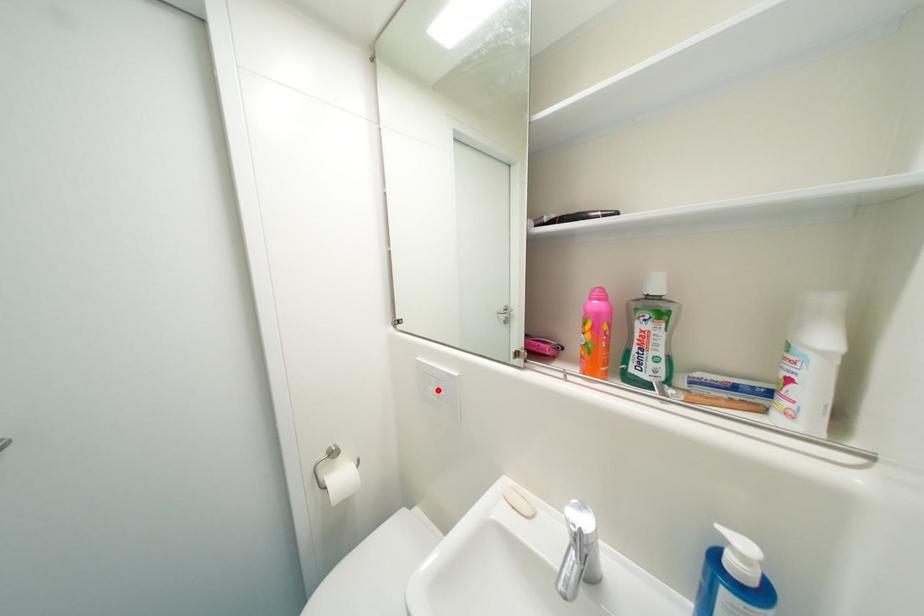
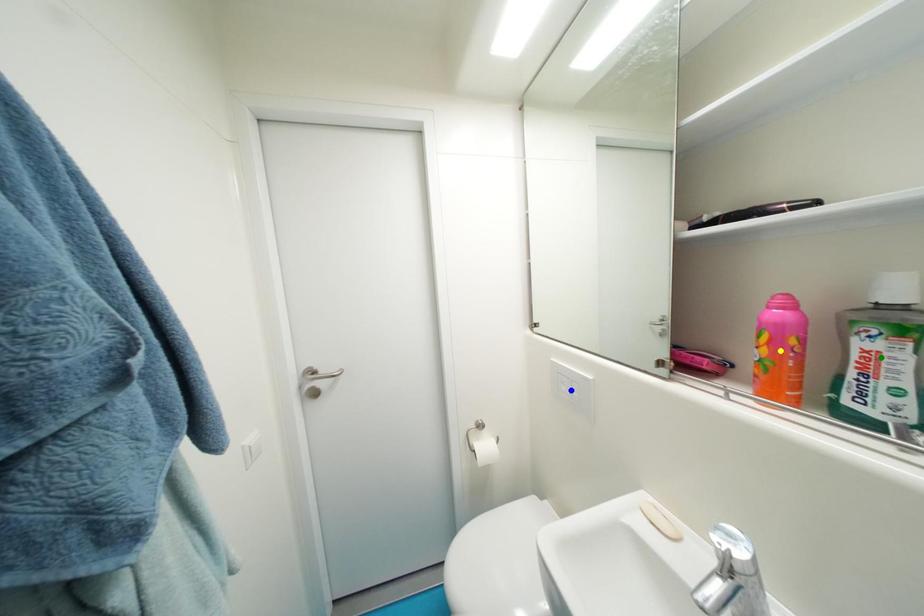
Question: I am providing you with two images of the same scene from different viewpoints. A red point is marked on the first image. You are given multiple points on the second image. Which point in image 2 is actually the same real-world point as the red point in image 1?

Choices:
 (A) green point
 (B) yellow point
 (C) blue point

Answer: (C)